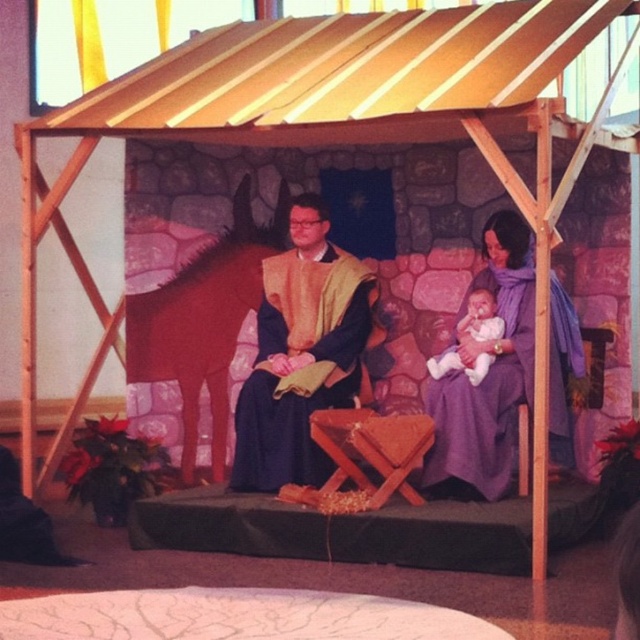
Does purple fabric at center appear under brown matte horse at left?

Yes, purple fabric at center is below brown matte horse at left.

Who is more forward, (518, 392) or (192, 324)?

Positioned in front is point (518, 392).

What are the coordinates of `purple fabric at center` in the screenshot? It's located at (486, 374).

Is purple fabric at center smaller than soft pink fabric baby at center?

No, purple fabric at center is not smaller than soft pink fabric baby at center.

Who is positioned more to the right, purple fabric at center or soft pink fabric baby at center?

Positioned to the right is purple fabric at center.

This screenshot has height=640, width=640. Find the location of `purple fabric at center`. purple fabric at center is located at coordinates (486, 374).

Between matte gold robe at center and brown matte horse at left, which one appears on the left side from the viewer's perspective?

Positioned to the left is brown matte horse at left.

Is matte gold robe at center taller than brown matte horse at left?

Incorrect, matte gold robe at center's height is not larger of brown matte horse at left's.

Measure the distance between point (321, 352) and camera.

Point (321, 352) and camera are 6.32 meters apart.

Locate an element on the screen. The width and height of the screenshot is (640, 640). matte gold robe at center is located at coordinates (301, 353).